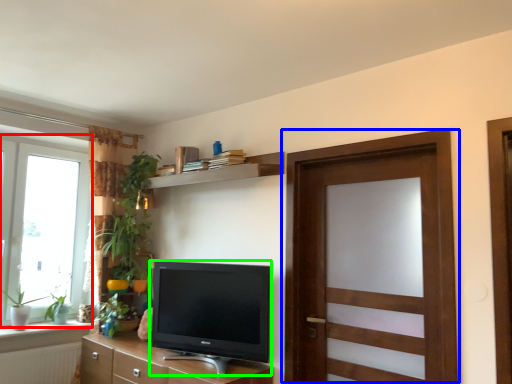
Question: Which object is positioned closest to window (highlighted by a red box)? Select from door (highlighted by a blue box) and television (highlighted by a green box).

Choices:
 (A) door
 (B) television

Answer: (B)